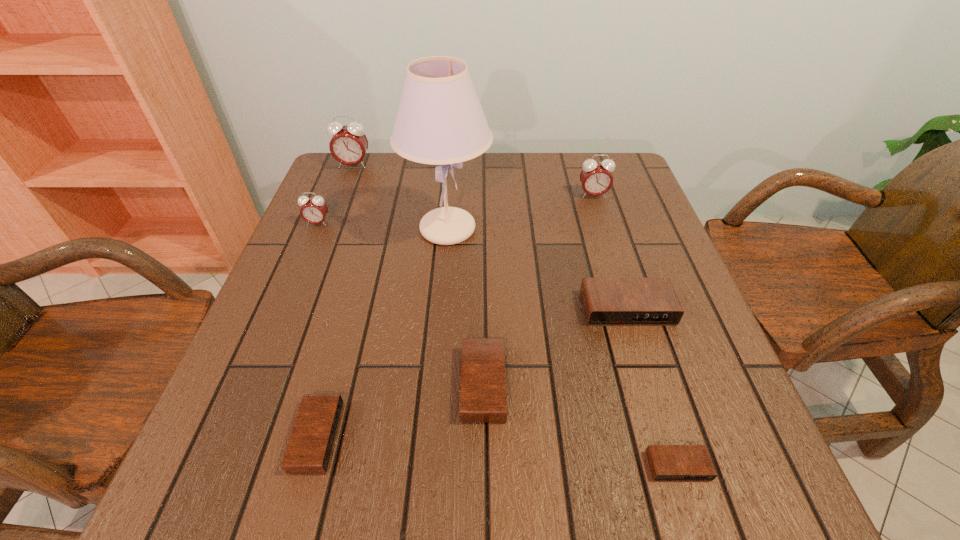
You are a GUI agent. You are given a task and a screenshot of the screen. Output one action in this format:
    pyautogui.click(x=<x>, y=<y>)
    Task: Click on the empty location between the farthest object and the tallest object
    The width and height of the screenshot is (960, 540).
    Given the screenshot: What is the action you would take?
    pyautogui.click(x=400, y=197)

Identify the location of vacant area that lies between the third farthest alarm clock and the sixth tallest object. This screenshot has width=960, height=540. (400, 303).

The image size is (960, 540). Identify the location of vacant space in between the farthest black alarm clock and the smallest black alarm clock. (653, 387).

Identify the location of object that is the closest one to the second tallest object. This screenshot has height=540, width=960. (440, 121).

Find the location of a particular element. This screenshot has height=540, width=960. object that ranks as the third closest to the farthest pink alarm clock is located at coordinates (596, 179).

Locate which alarm clock is the second closest to the shortest alarm clock. Please provide its 2D coordinates. Your answer should be formatted as a tuple, i.e. [(x, y)], where the tuple contains the x and y coordinates of a point satisfying the conditions above.

[(606, 301)]

You are a GUI agent. You are given a task and a screenshot of the screen. Output one action in this format:
    pyautogui.click(x=<x>, y=<y>)
    Task: Click on the fifth closest alarm clock to the fifth farthest object
    The height and width of the screenshot is (540, 960).
    Given the screenshot: What is the action you would take?
    pyautogui.click(x=313, y=210)

Identify which pink alarm clock is the third closest to the sixth tallest object. Please provide its 2D coordinates. Your answer should be formatted as a tuple, i.e. [(x, y)], where the tuple contains the x and y coordinates of a point satisfying the conditions above.

[(349, 144)]

Where is `pink alarm clock that is the closest to the tallest alarm clock`? pink alarm clock that is the closest to the tallest alarm clock is located at coordinates pos(313,210).

At what (x,y) coordinates should I click in order to perform the action: click on black alarm clock that stands as the third closest to the tallest alarm clock. Please return your answer as a coordinate pair (x, y). This screenshot has width=960, height=540. Looking at the image, I should click on (310, 445).